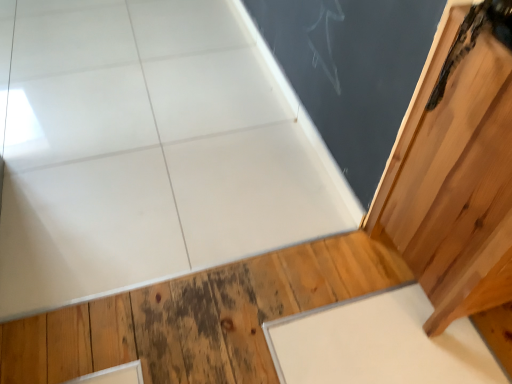
Question: Does white matte slate at lower right have a greater height compared to natural wood floor at lower right?

Choices:
 (A) no
 (B) yes

Answer: (B)

Question: From a real-world perspective, does white matte slate at lower right sit lower than natural wood floor at lower right?

Choices:
 (A) yes
 (B) no

Answer: (B)

Question: Considering the relative positions of white matte slate at lower right and natural wood floor at lower right in the image provided, is white matte slate at lower right in front of natural wood floor at lower right?

Choices:
 (A) yes
 (B) no

Answer: (B)

Question: From the image's perspective, would you say white matte slate at lower right is positioned over natural wood floor at lower right?

Choices:
 (A) no
 (B) yes

Answer: (A)

Question: Can you confirm if white matte slate at lower right is positioned to the left of natural wood floor at lower right?

Choices:
 (A) yes
 (B) no

Answer: (B)

Question: Is white matte slate at lower right beside natural wood floor at lower right?

Choices:
 (A) yes
 (B) no

Answer: (B)

Question: Is natural wood floor at lower right smaller than matte black chalkboard at upper right?

Choices:
 (A) no
 (B) yes

Answer: (A)

Question: Considering the relative sizes of natural wood floor at lower right and matte black chalkboard at upper right in the image provided, is natural wood floor at lower right taller than matte black chalkboard at upper right?

Choices:
 (A) yes
 (B) no

Answer: (B)

Question: Is natural wood floor at lower right closer to camera compared to matte black chalkboard at upper right?

Choices:
 (A) no
 (B) yes

Answer: (B)

Question: Does natural wood floor at lower right have a lesser width compared to matte black chalkboard at upper right?

Choices:
 (A) no
 (B) yes

Answer: (A)

Question: From a real-world perspective, is natural wood floor at lower right physically above matte black chalkboard at upper right?

Choices:
 (A) yes
 (B) no

Answer: (B)

Question: Is the depth of natural wood floor at lower right greater than that of matte black chalkboard at upper right?

Choices:
 (A) yes
 (B) no

Answer: (B)

Question: Is white matte slate at lower right far away from wooden door at upper right?

Choices:
 (A) no
 (B) yes

Answer: (A)